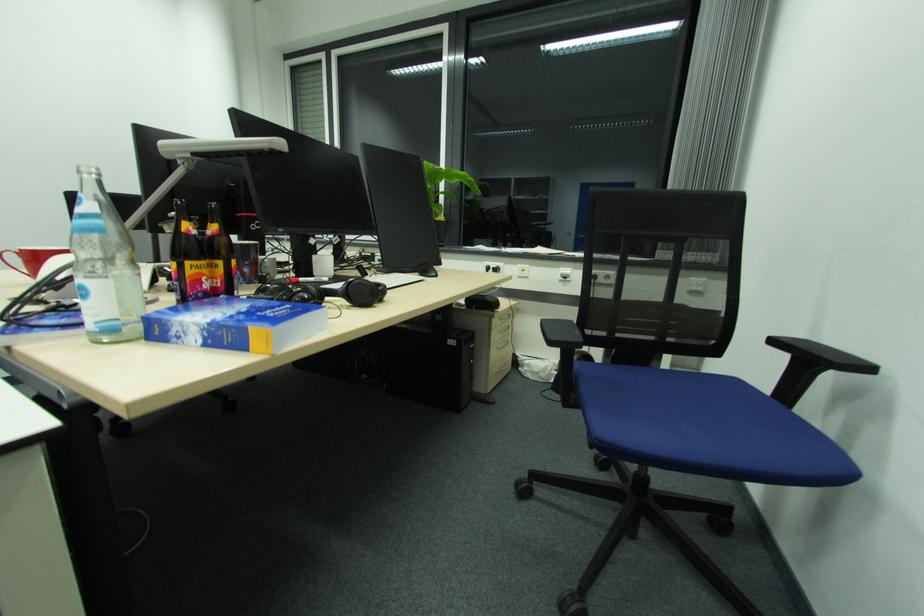
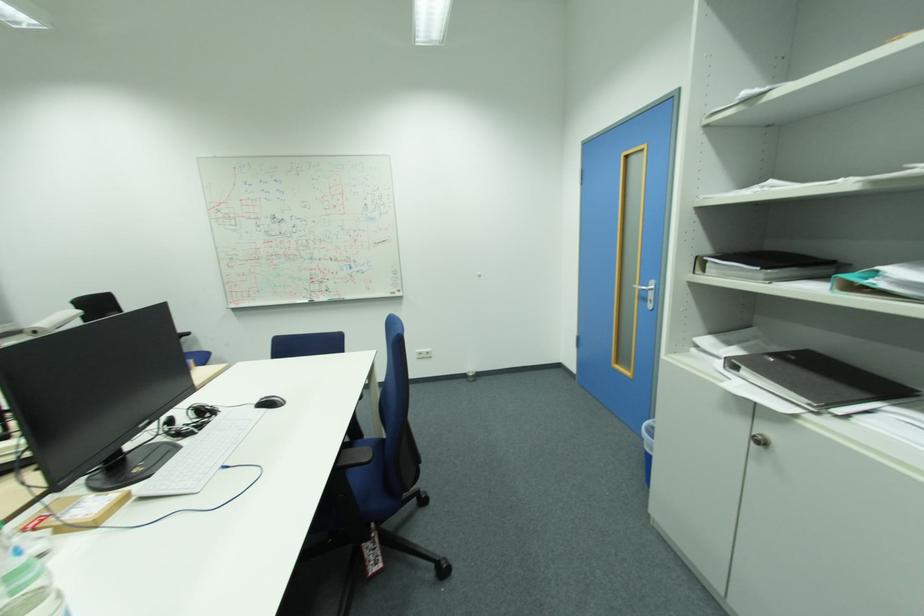
Question: I am providing you with two images of the same scene from different viewpoints. Please identify which objects are invisible in image2.

Choices:
 (A) blue chair sitting surface
 (B) access panel lock
 (C) white keyboard
 (D) black notebook

Answer: (A)